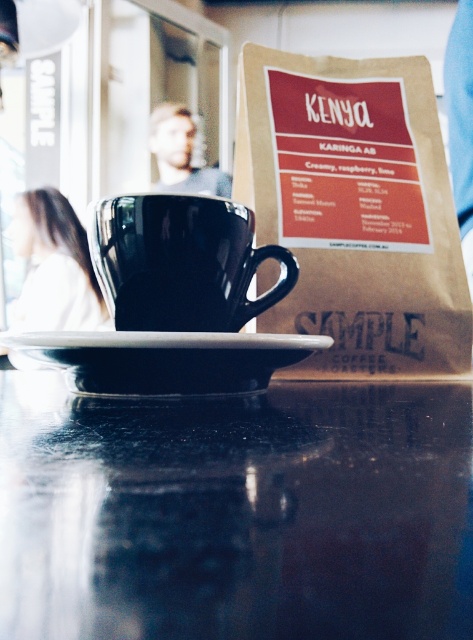
You are a customer at the cozy cafe and want to place your phone on the table. The table has two spots available at the coordinates point (415,516) and point (122,355). If you want to place your phone closer to the edge of the table, which coordinate should you choose?

Point (415,516) is closer to the edge of the table than point (122,355) because it is positioned further away from the center of the table.